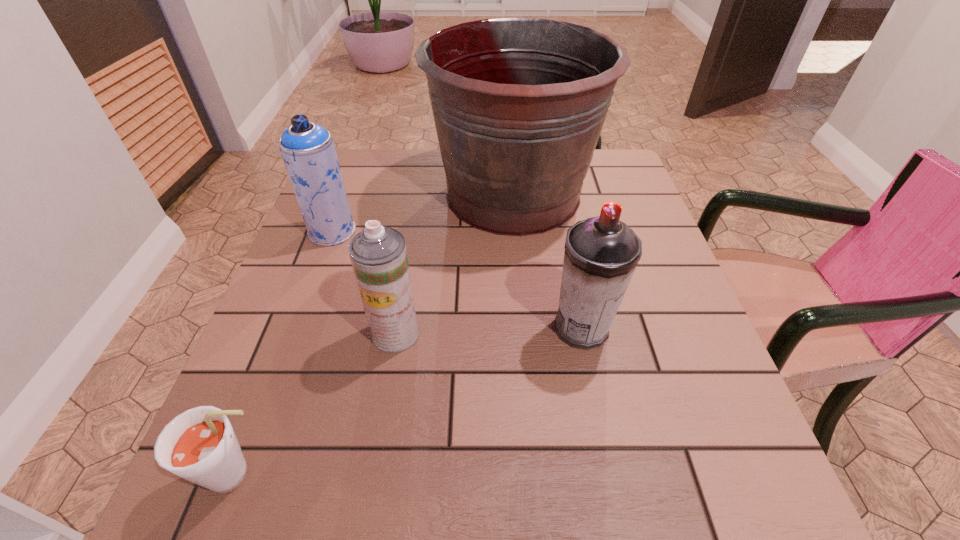
Image resolution: width=960 pixels, height=540 pixels. I want to click on vacant region between the tallest object and the rightmost aerosol can, so click(547, 261).

What are the coordinates of `vacant area that lies between the second aerosol can from right to left and the bucket` in the screenshot? It's located at (454, 264).

Find the location of a particular element. This screenshot has height=540, width=960. vacant space in between the bucket and the rightmost aerosol can is located at coordinates (547, 261).

Locate an element on the screen. object that stands as the closest to the nearest object is located at coordinates (378, 254).

Locate an element on the screen. The image size is (960, 540). the third closest object relative to the second aerosol can from left to right is located at coordinates (308, 151).

The image size is (960, 540). Find the location of `aerosol can object that ranks as the second closest to the leftmost aerosol can`. aerosol can object that ranks as the second closest to the leftmost aerosol can is located at coordinates (601, 253).

The width and height of the screenshot is (960, 540). Find the location of `aerosol can that is the closest one to the shortest object`. aerosol can that is the closest one to the shortest object is located at coordinates (378, 254).

Where is `free space that satisfies the following two spatial constraints: 1. on the back side of the bucket; 2. on the right side of the second aerosol can from right to left`? free space that satisfies the following two spatial constraints: 1. on the back side of the bucket; 2. on the right side of the second aerosol can from right to left is located at coordinates (420, 194).

In order to click on vacant space that satisfies the following two spatial constraints: 1. on the back side of the leftmost aerosol can; 2. on the left side of the bucket in this screenshot , I will do `click(346, 194)`.